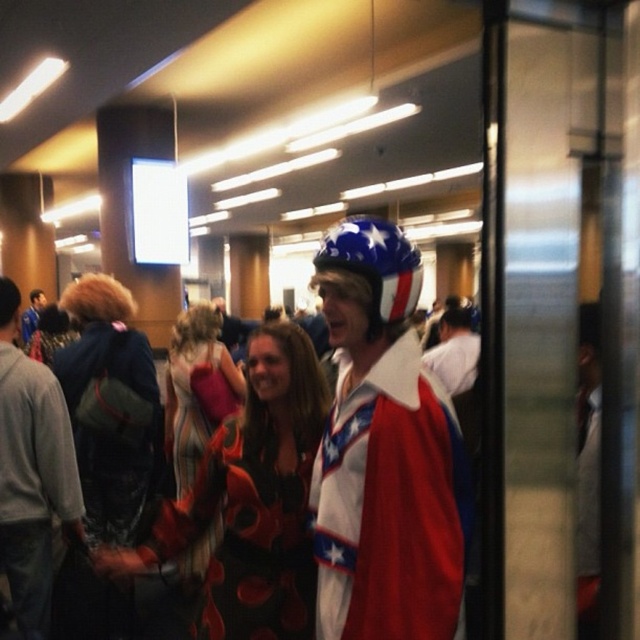
Can you confirm if shiny metallic helmet at center is taller than matte blue helmet at center?

Indeed, shiny metallic helmet at center has a greater height compared to matte blue helmet at center.

Between shiny metallic helmet at center and matte blue helmet at center, which one appears on the right side from the viewer's perspective?

From the viewer's perspective, shiny metallic helmet at center appears more on the right side.

Find the location of a particular element. shiny metallic helmet at center is located at coordinates (385, 452).

Does matte black dress at center appear on the right side of matte blue helmet at center?

Yes, matte black dress at center is to the right of matte blue helmet at center.

Is matte black dress at center to the left of matte blue helmet at center from the viewer's perspective?

Incorrect, matte black dress at center is not on the left side of matte blue helmet at center.

Between point (227, 515) and point (36, 300), which one is positioned behind?

The point (36, 300) is behind.

In order to click on matte black dress at center in this screenshot , I will do `click(252, 499)`.

This screenshot has width=640, height=640. What do you see at coordinates (385, 452) in the screenshot? I see `shiny metallic helmet at center` at bounding box center [385, 452].

Between point (353, 390) and point (12, 522), which one is positioned behind?

The point (12, 522) is more distant.

In order to click on shiny metallic helmet at center in this screenshot , I will do `click(385, 452)`.